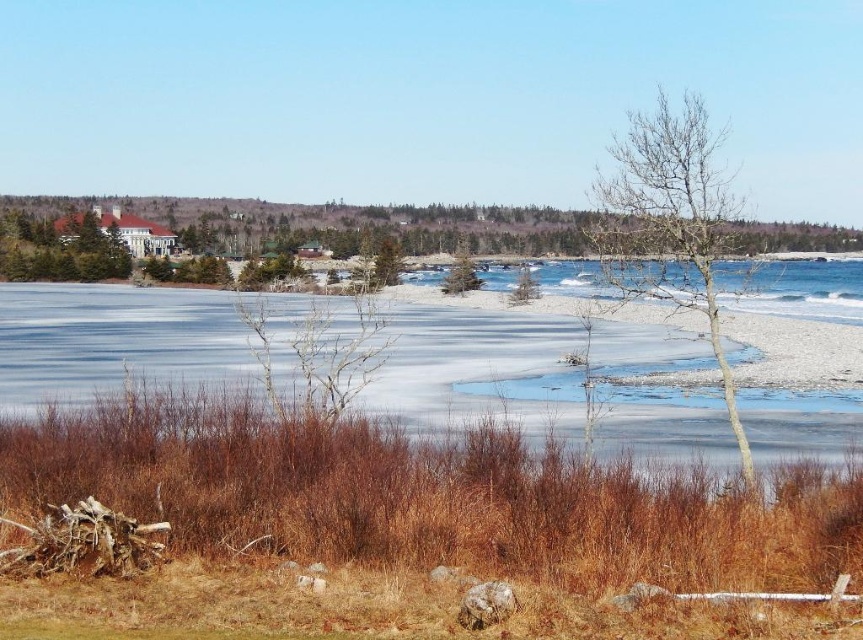
Measure the distance between green textured pine tree at center and camera.

green textured pine tree at center and camera are 92.29 meters apart from each other.

Can you confirm if green textured pine tree at center is smaller than green matte tree at center?

Actually, green textured pine tree at center might be larger than green matte tree at center.

This screenshot has height=640, width=863. What do you see at coordinates (461, 273) in the screenshot?
I see `green textured pine tree at center` at bounding box center [461, 273].

The width and height of the screenshot is (863, 640). In order to click on green textured pine tree at center in this screenshot , I will do `click(461, 273)`.

You are a GUI agent. You are given a task and a screenshot of the screen. Output one action in this format:
    pyautogui.click(x=<x>, y=<y>)
    Task: Click on the bare wood tree at center
    
    Given the screenshot: What is the action you would take?
    pyautogui.click(x=671, y=225)

Who is more forward, (698, 227) or (457, 262)?

Point (698, 227)

Where is `bare wood tree at center`? bare wood tree at center is located at coordinates (671, 225).

The width and height of the screenshot is (863, 640). In order to click on bare wood tree at center in this screenshot , I will do `click(671, 225)`.

Can you confirm if frozen ice at center is bigger than green textured pine tree at center?

Yes.

Does point (42, 404) come farther from viewer compared to point (471, 266)?

No, (42, 404) is in front of (471, 266).

At what (x,y) coordinates should I click in order to perform the action: click on frozen ice at center. Please return your answer as a coordinate pair (x, y). Looking at the image, I should click on (115, 340).

You are a GUI agent. You are given a task and a screenshot of the screen. Output one action in this format:
    pyautogui.click(x=<x>, y=<y>)
    Task: Click on the frozen ice at center
    Image resolution: width=863 pixels, height=640 pixels.
    Given the screenshot: What is the action you would take?
    pyautogui.click(x=115, y=340)